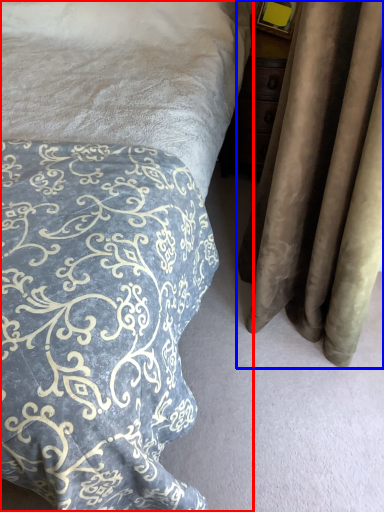
Question: Which object appears closest to the camera in this image, bed (highlighted by a red box) or curtain (highlighted by a blue box)?

Choices:
 (A) bed
 (B) curtain

Answer: (A)